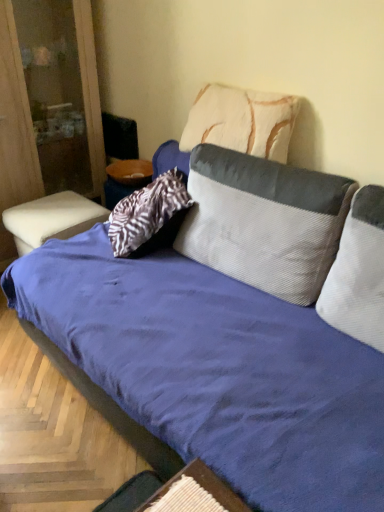
The image size is (384, 512). What are the coordinates of `empty space that is ontop of white leather ottoman at lower left, which ranks as the second table in bottom-to-top order (from a real-world perspective)` in the screenshot? It's located at (51, 209).